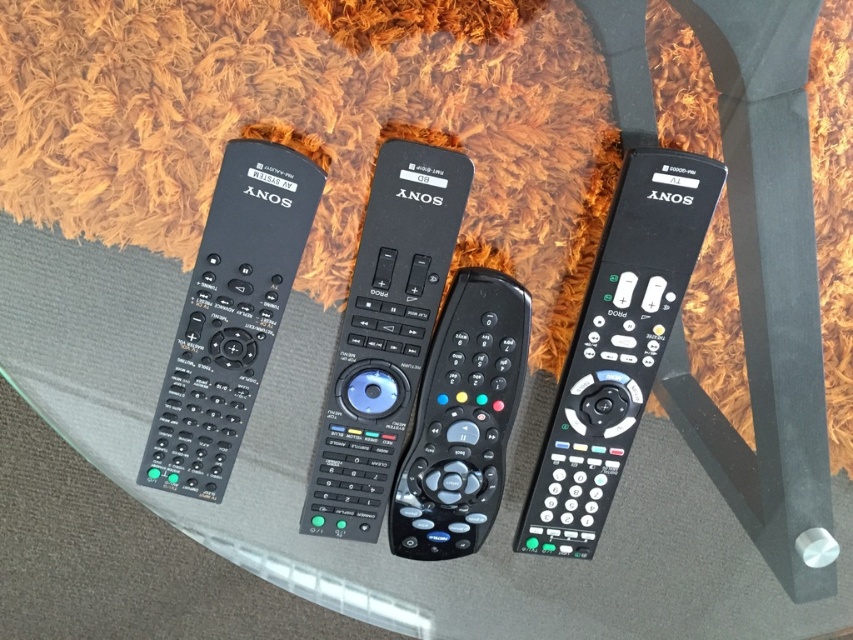
Between black matte remote at center and black plastic remote at center, which one appears on the left side from the viewer's perspective?

From the viewer's perspective, black matte remote at center appears more on the left side.

Which of these two, black matte remote at center or black plastic remote at center, stands taller?

With more height is black matte remote at center.

Find the location of a particular element. The width and height of the screenshot is (853, 640). black matte remote at center is located at coordinates (384, 333).

Does black plastic remote at right have a greater width compared to black matte remote at center?

Yes, black plastic remote at right is wider than black matte remote at center.

Does point (543, 525) come closer to viewer compared to point (430, 330)?

No, (543, 525) is further to viewer.

Image resolution: width=853 pixels, height=640 pixels. Find the location of `black plastic remote at right`. black plastic remote at right is located at coordinates (618, 346).

Can you confirm if black matte remote at left is positioned to the left of black plastic remote at center?

Indeed, black matte remote at left is positioned on the left side of black plastic remote at center.

Looking at this image, can you confirm if black matte remote at left is positioned to the right of black plastic remote at center?

Incorrect, black matte remote at left is not on the right side of black plastic remote at center.

Between point (140, 483) and point (457, 355), which one is positioned in front?

Point (457, 355) is in front.

At what (x,y) coordinates should I click in order to perform the action: click on black matte remote at left. Please return your answer as a coordinate pair (x, y). Looking at the image, I should click on click(230, 316).